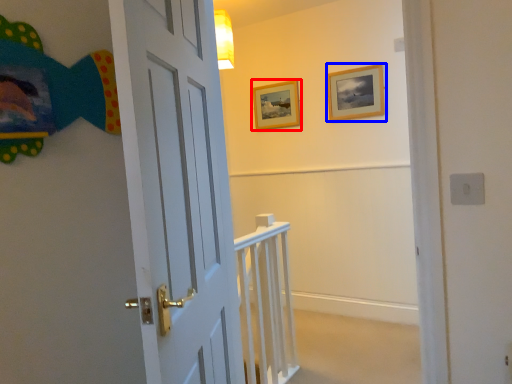
Question: Which point is closer to the camera, picture frame (highlighted by a red box) or picture frame (highlighted by a blue box)?

Choices:
 (A) picture frame
 (B) picture frame

Answer: (B)